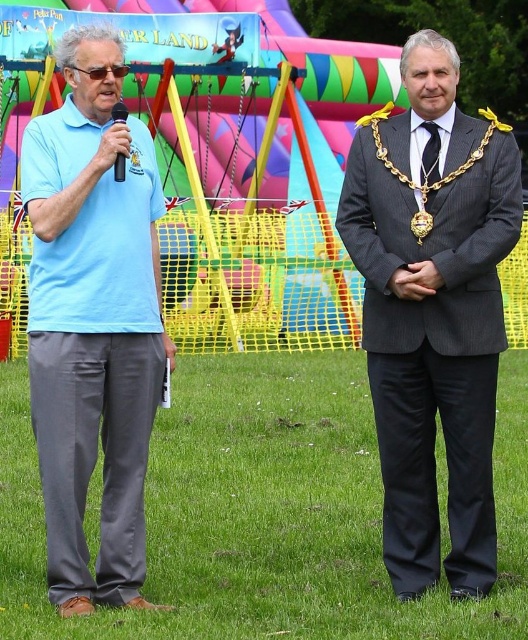
You are a photographer at the event and need to position yourself so that the light blue cotton shirt at left and the black plastic microphone at left are both clearly visible in the frame. Based on their positions, which side of the scene should you stand to capture both objects in the shot?

You should position yourself to the right side of the scene because the light blue cotton shirt at left is to the left of the black plastic microphone at left, so standing on the right would allow both objects to be in the frame.

You are standing at the point with coordinates point (122, 115) and want to walk towards the point with coordinates point (444, 362). Which direction should you move?

You should move forward because point (444, 362) is in front of point (122, 115).

You are attending a community event and see two people. The first person is wearing a light blue cotton shirt at left, and the second is wearing a black silk tie at center. From your perspective, which clothing item is positioned more to the left?

The light blue cotton shirt at left is positioned more to the left than the black silk tie at center.